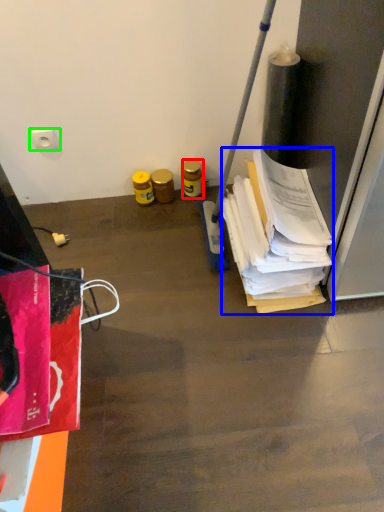
Question: Based on their relative distances, which object is farther from bottle (highlighted by a red box)? Choose from wrapping paper (highlighted by a blue box) and power plugs and sockets (highlighted by a green box).

Choices:
 (A) wrapping paper
 (B) power plugs and sockets

Answer: (B)